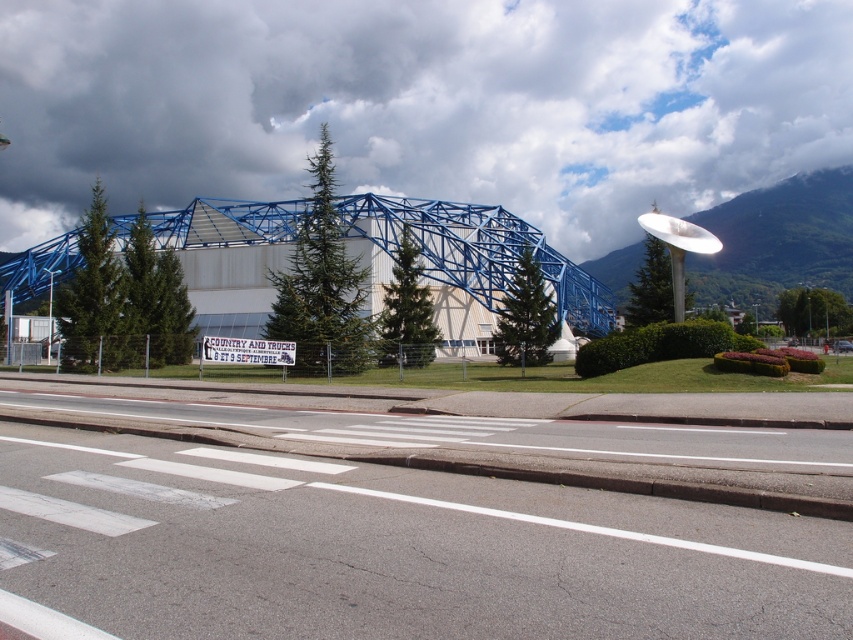
Between white matte structure at upper center and white glossy mountain at upper center, which one appears on the left side from the viewer's perspective?

From the viewer's perspective, white matte structure at upper center appears more on the left side.

Does white matte structure at upper center have a greater width compared to white glossy mountain at upper center?

Yes, white matte structure at upper center is wider than white glossy mountain at upper center.

The height and width of the screenshot is (640, 853). Find the location of `white matte structure at upper center`. white matte structure at upper center is located at coordinates (421, 104).

Is blue metallic structure at center to the left of white glossy mountain at upper center from the viewer's perspective?

Correct, you'll find blue metallic structure at center to the left of white glossy mountain at upper center.

Which is in front, point (357, 209) or point (792, 260)?

Positioned in front is point (357, 209).

I want to click on blue metallic structure at center, so click(474, 252).

Between white matte structure at upper center and blue metallic structure at center, which one appears on the right side from the viewer's perspective?

white matte structure at upper center is more to the right.

Which of these two, white matte structure at upper center or blue metallic structure at center, stands taller?

Standing taller between the two is white matte structure at upper center.

Is point (700, 182) more distant than point (229, 269)?

That is True.

The height and width of the screenshot is (640, 853). Identify the location of white matte structure at upper center. (421, 104).